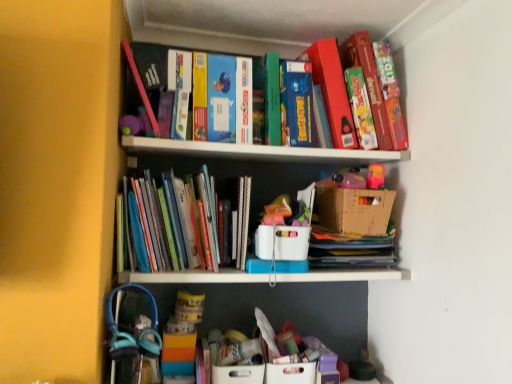
Question: In terms of size, does cardboard box at upper center, which is the first cardboard box in right-to-left order, appear bigger or smaller than hardcover books at center?

Choices:
 (A) small
 (B) big

Answer: (A)

Question: Relative to hardcover books at center, is cardboard box at upper center, placed as the second cardboard box when sorted from left to right, in front or behind?

Choices:
 (A) front
 (B) behind

Answer: (B)

Question: Which is nearer to the white cardboard box at center, the second cardboard box in the right-to-left sequence?

Choices:
 (A) cardboard box at upper center, placed as the second cardboard box when sorted from left to right
 (B) hardcover books at center

Answer: (A)

Question: Which is farther from the hardcover books at center?

Choices:
 (A) cardboard box at upper center, placed as the second cardboard box when sorted from left to right
 (B) white cardboard box at center, positioned as the 1th cardboard box in left-to-right order

Answer: (A)